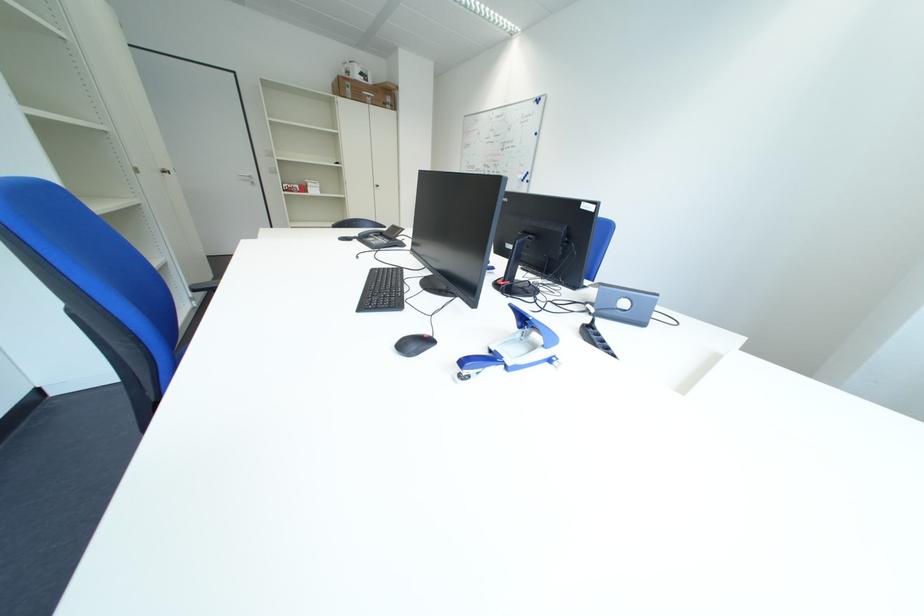
This screenshot has width=924, height=616. I want to click on silver door handle, so [x=247, y=177].